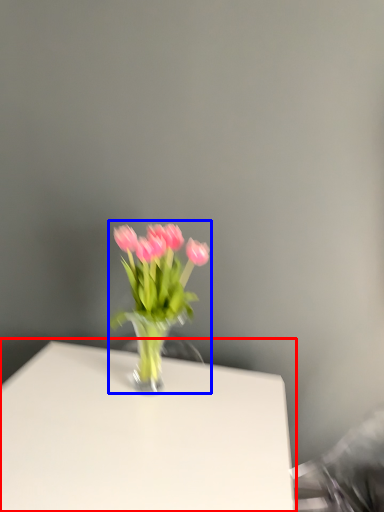
Question: Which point is further to the camera, table (highlighted by a red box) or floral arrangement (highlighted by a blue box)?

Choices:
 (A) table
 (B) floral arrangement

Answer: (B)